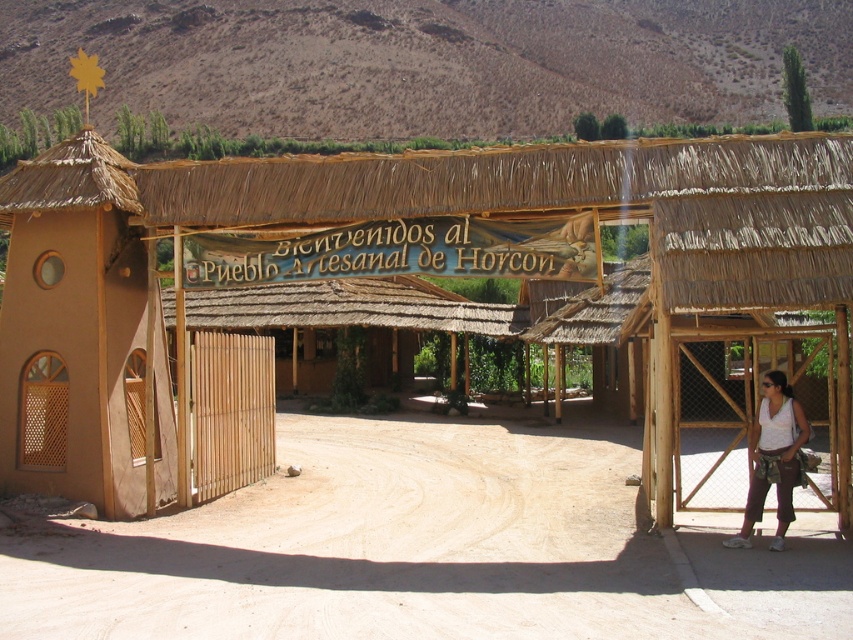
You are standing at the entrance of Pueblo Artesanal de Horcon and see two points marked on the gate. The first point is at coordinate point (529, 508) and the second is at point (778, 534). Which point is closer to you?

Point (529, 508) is further to the camera than point (778, 534), so the point closer to you is point (778, 534).

You are standing at the entrance of Pueblo Artesanal de Horcon and want to reach the dirt path leading into the village. The point where you need to step to enter the path is marked as point (74, 324). If you are currently 10 meters away from this point, how many more meters do you need to walk to reach the path?

The point (74, 324) is 11.16 meters from the viewer. Since you are currently 10 meters away from this point, you need to walk an additional 1.16 meters to reach the path.